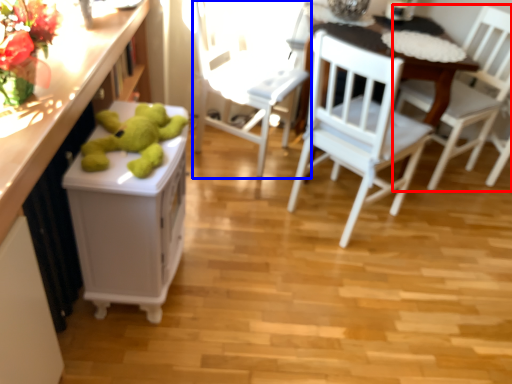
Question: Which of the following is the farthest to the observer, chair (highlighted by a red box) or chair (highlighted by a blue box)?

Choices:
 (A) chair
 (B) chair

Answer: (A)